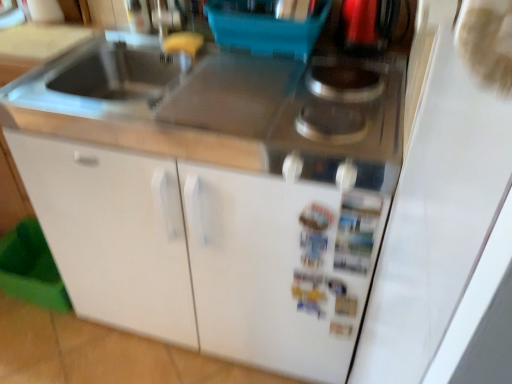
Question: Would you consider metallic silver gas stove at upper right to be distant from white matte cabinet at center, which is the 1th cabinetry in right-to-left order?

Choices:
 (A) yes
 (B) no

Answer: (B)

Question: Can you confirm if metallic silver gas stove at upper right is wider than white matte cabinet at center, which is the 1th cabinetry in right-to-left order?

Choices:
 (A) yes
 (B) no

Answer: (B)

Question: Can you confirm if metallic silver gas stove at upper right is shorter than white matte cabinet at center, which is the 1th cabinetry in right-to-left order?

Choices:
 (A) no
 (B) yes

Answer: (B)

Question: From the image's perspective, is metallic silver gas stove at upper right located above white matte cabinet at center, which is the 1th cabinetry in right-to-left order?

Choices:
 (A) yes
 (B) no

Answer: (A)

Question: Does metallic silver gas stove at upper right appear on the right side of white matte cabinet at center, marked as the 2th cabinetry in a left-to-right arrangement?

Choices:
 (A) no
 (B) yes

Answer: (B)

Question: Looking at their shapes, would you say white matte cabinet at lower left, acting as the 1th cabinetry starting from the left, is wider or thinner than metallic silver gas stove at upper right?

Choices:
 (A) wide
 (B) thin

Answer: (A)

Question: Is white matte cabinet at lower left, acting as the 1th cabinetry starting from the left, spatially inside metallic silver gas stove at upper right, or outside of it?

Choices:
 (A) inside
 (B) outside

Answer: (B)

Question: Is white matte cabinet at lower left, acting as the 1th cabinetry starting from the left, in front of or behind metallic silver gas stove at upper right in the image?

Choices:
 (A) front
 (B) behind

Answer: (A)

Question: Considering the positions of white matte cabinet at lower left, acting as the 1th cabinetry starting from the left, and metallic silver gas stove at upper right in the image, is white matte cabinet at lower left, acting as the 1th cabinetry starting from the left, bigger or smaller than metallic silver gas stove at upper right?

Choices:
 (A) big
 (B) small

Answer: (A)

Question: From a real-world perspective, is metallic silver gas stove at upper right positioned above or below white matte cabinet at center, marked as the 2th cabinetry in a left-to-right arrangement?

Choices:
 (A) above
 (B) below

Answer: (A)

Question: Is metallic silver gas stove at upper right spatially inside white matte cabinet at center, marked as the 2th cabinetry in a left-to-right arrangement, or outside of it?

Choices:
 (A) outside
 (B) inside

Answer: (B)

Question: Does point (401, 69) appear closer or farther from the camera than point (71, 286)?

Choices:
 (A) farther
 (B) closer

Answer: (B)

Question: Would you say metallic silver gas stove at upper right is to the left or to the right of white matte cabinet at center, which is the 1th cabinetry in right-to-left order, in the picture?

Choices:
 (A) right
 (B) left

Answer: (A)

Question: Does point (145, 274) appear closer or farther from the camera than point (188, 296)?

Choices:
 (A) closer
 (B) farther

Answer: (A)

Question: From a real-world perspective, is white matte cabinet at center, marked as the 2th cabinetry in a left-to-right arrangement, positioned above or below white matte cabinet at lower left, acting as the 1th cabinetry starting from the left?

Choices:
 (A) below
 (B) above

Answer: (A)